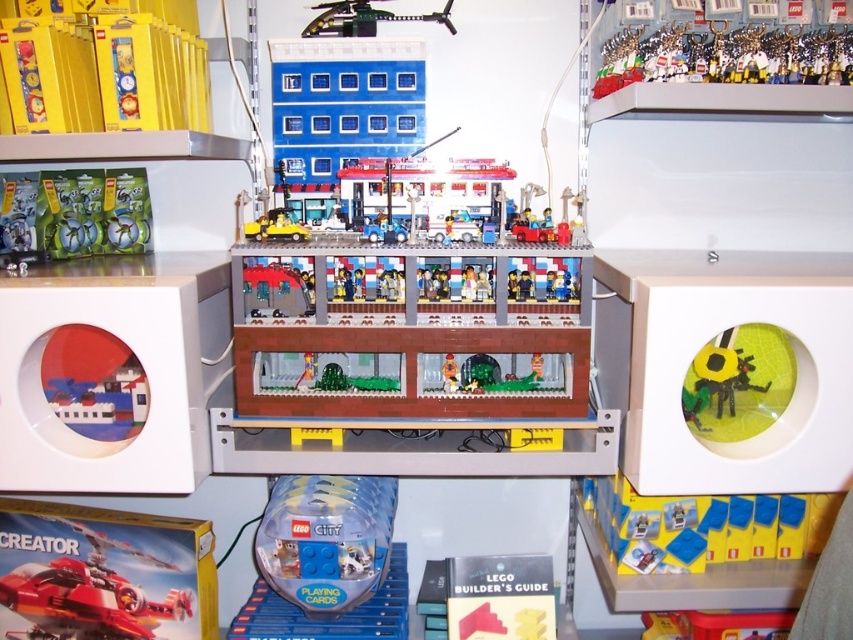
Can you confirm if shiny red airplane at lower left is positioned above metallic green helicopter at upper center?

No.

From the picture: Between shiny red airplane at lower left and metallic green helicopter at upper center, which one is positioned higher?

metallic green helicopter at upper center

Who is more forward, (109, 605) or (390, 12)?

Point (109, 605) is more forward.

The width and height of the screenshot is (853, 640). I want to click on shiny red airplane at lower left, so click(85, 602).

Can you confirm if metallic silver trophy at upper right is positioned to the left of yellow matte sunflower at right?

No, metallic silver trophy at upper right is not to the left of yellow matte sunflower at right.

Is metallic silver trophy at upper right further to the viewer compared to yellow matte sunflower at right?

Yes, it is.

Measure the distance between metallic silver trophy at upper right and camera.

The distance of metallic silver trophy at upper right from camera is 1.11 meters.

Where is `metallic silver trophy at upper right`? metallic silver trophy at upper right is located at coordinates (724, 54).

Can you confirm if shiny red airplane at lower left is positioned to the left of yellow matte sunflower at right?

Correct, you'll find shiny red airplane at lower left to the left of yellow matte sunflower at right.

Who is taller, shiny red airplane at lower left or yellow matte sunflower at right?

Standing taller between the two is shiny red airplane at lower left.

This screenshot has height=640, width=853. Describe the element at coordinates (85, 602) in the screenshot. I see `shiny red airplane at lower left` at that location.

At what (x,y) coordinates should I click in order to perform the action: click on shiny red airplane at lower left. Please return your answer as a coordinate pair (x, y). This screenshot has height=640, width=853. Looking at the image, I should click on (85, 602).